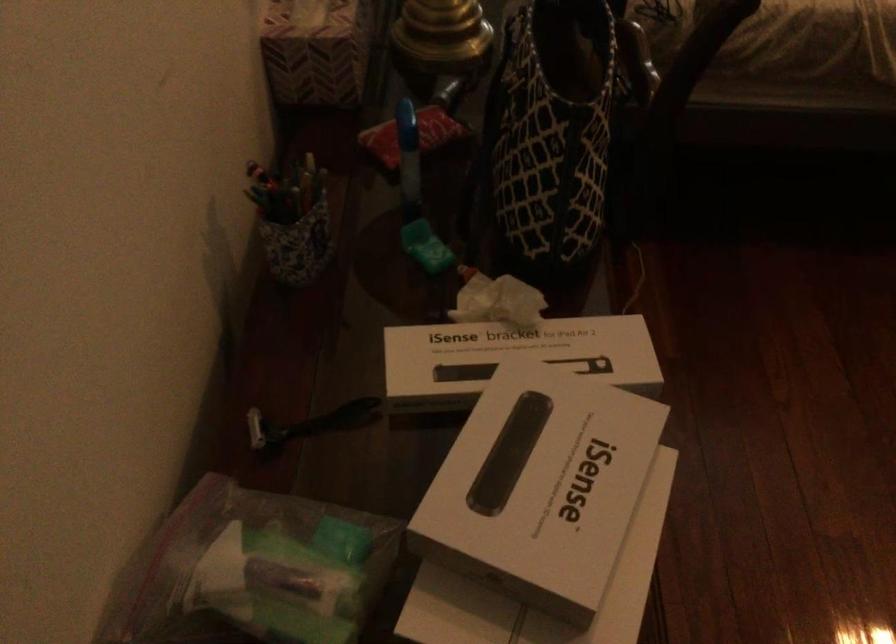
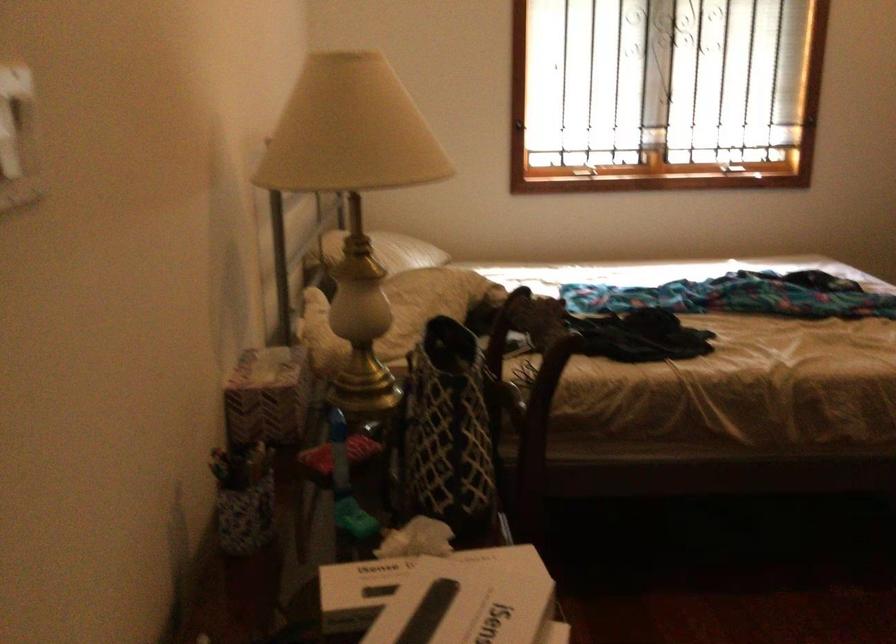
Locate, in the second image, the point that corresponds to (x=492, y=388) in the first image.

(407, 583)